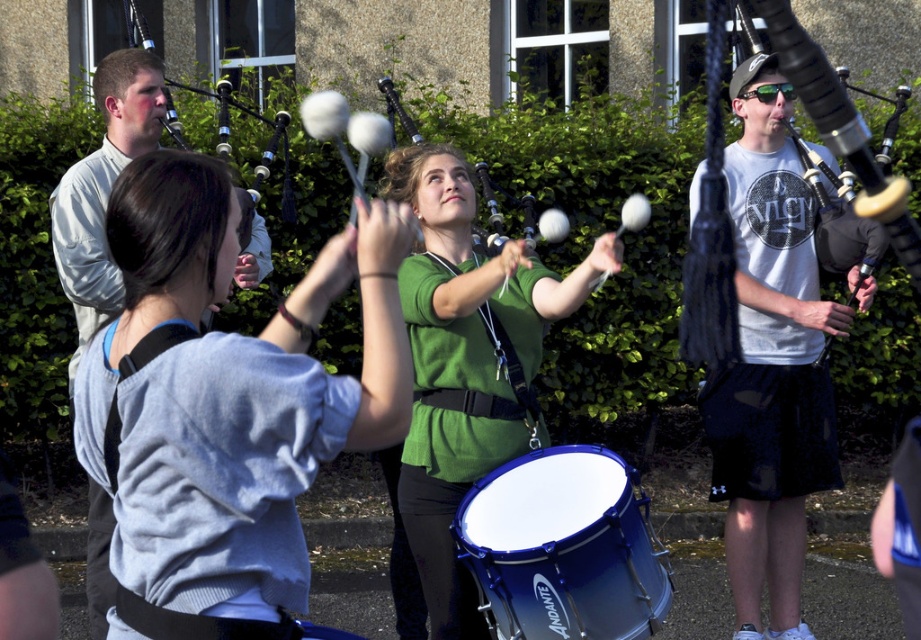
You are a photographer trying to capture a candid shot of both the light blue sweater at center and the light gray shirt at left. Since you want to ensure both subjects are fully visible in the photo, which subject should you position closer to the camera to avoid blocking?

The light blue sweater at center is in front of the light gray shirt at left, so to ensure both are fully visible, position the light gray shirt at left closer to the camera so it isn not blocked by the light blue sweater at center.